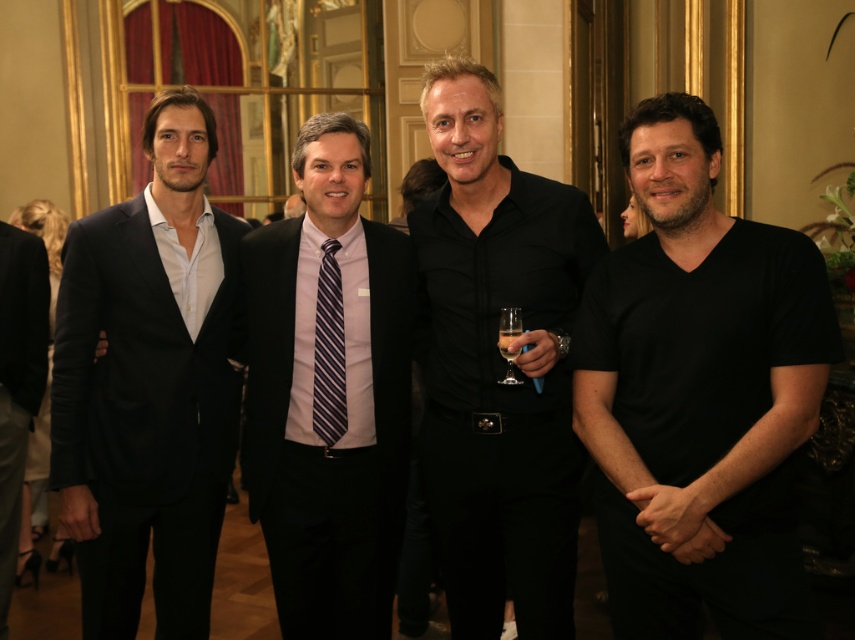
You are a photographer setting up for a group photo. You need to arrange the black smooth shirt at center and the black matte suit at left so that both are visible in the frame. Given their height difference, which object should be placed in the front to avoid blocking the other?

The black smooth shirt at center is much taller than the black matte suit at left, so to avoid blocking the shorter person, the black matte suit at left should be placed in the front.

You are a photographer at a formal event. You need to capture a photo of the black smooth shirt at center and the black matte suit at left. Based on their positions, which one is closer to the right side of the frame?

The black smooth shirt at center is closer to the right side of the frame because it is positioned to the right of the black matte suit at left.